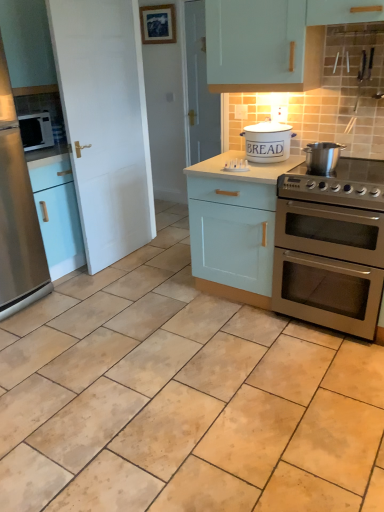
Identify the location of light blue wood cabinet at center. This screenshot has height=512, width=384. (234, 226).

Describe the element at coordinates (234, 226) in the screenshot. I see `light blue wood cabinet at center` at that location.

Describe the element at coordinates (36, 131) in the screenshot. I see `satin silver microwave at left` at that location.

The image size is (384, 512). What do you see at coordinates (329, 265) in the screenshot?
I see `satin silver oven at right` at bounding box center [329, 265].

What is the approximate width of white ceramic bread bin at center, the 2th appliance from the front?

11.77 inches.

Locate an element on the screen. This screenshot has width=384, height=512. light blue wood cabinet at center is located at coordinates (234, 226).

Is light blue wood cabinet at center looking in the opposite direction of stainless steel refrigerator at left?

No.

Locate an element on the screen. Image resolution: width=384 pixels, height=512 pixels. cabinetry below the stainless steel refrigerator at left (from the image's perspective) is located at coordinates (234, 226).

Is there a large distance between light blue wood cabinet at center and stainless steel refrigerator at left?

Yes, light blue wood cabinet at center and stainless steel refrigerator at left are quite far apart.

Which point is more forward, (204,263) or (1,269)?

The point (1,269) is more forward.

Which is more distant, (x=274, y=151) or (x=16, y=181)?

The point (x=16, y=181) is farther from the camera.

Which is behind, white ceramic bread bin at center, the 1th appliance from the back, or stainless steel refrigerator at left?

Positioned behind is white ceramic bread bin at center, the 1th appliance from the back.

Can you confirm if white ceramic bread bin at center, the 2th appliance from the front, is shorter than stainless steel refrigerator at left?

Indeed, white ceramic bread bin at center, the 2th appliance from the front, has a lesser height compared to stainless steel refrigerator at left.

Looking at this image, is white ceramic bread bin at center, the 1th appliance from the back, inside or outside of stainless steel refrigerator at left?

white ceramic bread bin at center, the 1th appliance from the back, cannot be found inside stainless steel refrigerator at left.

Is stainless steel gas stove at right smaller than stainless steel pot at upper right, the second appliance viewed from the back?

No, stainless steel gas stove at right is not smaller than stainless steel pot at upper right, the second appliance viewed from the back.

Consider the image. Is stainless steel gas stove at right at the left side of stainless steel pot at upper right, which is counted as the 1th appliance, starting from the front?

In fact, stainless steel gas stove at right is to the right of stainless steel pot at upper right, which is counted as the 1th appliance, starting from the front.

From a real-world perspective, relative to stainless steel pot at upper right, which is counted as the 1th appliance, starting from the front, is stainless steel gas stove at right vertically above or below?

From a real-world perspective, stainless steel gas stove at right is physically below stainless steel pot at upper right, which is counted as the 1th appliance, starting from the front.

Between stainless steel gas stove at right and stainless steel pot at upper right, which is counted as the 1th appliance, starting from the front, which one is positioned in front?

stainless steel gas stove at right is closer to the camera.

Is light blue wood cabinet at center not close to stainless steel pot at upper right, the second appliance viewed from the back?

Actually, light blue wood cabinet at center and stainless steel pot at upper right, the second appliance viewed from the back, are a little close together.

How far apart are light blue wood cabinet at center and stainless steel pot at upper right, the second appliance viewed from the back?

They are 22.28 inches apart.

Which is further, (237, 216) or (330, 172)?

The point (237, 216) is farther.

Looking at this image, visually, is light blue wood cabinet at center positioned to the left or to the right of stainless steel pot at upper right, which is counted as the 1th appliance, starting from the front?

In the image, light blue wood cabinet at center appears on the left side of stainless steel pot at upper right, which is counted as the 1th appliance, starting from the front.

In the image, is satin silver oven at right positioned in front of or behind light blue wood cabinet at center?

satin silver oven at right is in front of light blue wood cabinet at center.

Consider the image. Considering the sizes of objects satin silver oven at right and light blue wood cabinet at center in the image provided, who is smaller, satin silver oven at right or light blue wood cabinet at center?

satin silver oven at right is smaller.

From a real-world perspective, is satin silver oven at right positioned above or below light blue wood cabinet at center?

Clearly, from a real-world perspective, satin silver oven at right is below light blue wood cabinet at center.

Considering the relative sizes of satin silver oven at right and light blue wood cabinet at center in the image provided, is satin silver oven at right wider than light blue wood cabinet at center?

Yes, satin silver oven at right is wider than light blue wood cabinet at center.

Who is smaller, stainless steel gas stove at right or light blue wood cabinet at center?

Smaller between the two is stainless steel gas stove at right.

From a real-world perspective, between stainless steel gas stove at right and light blue wood cabinet at center, who is vertically lower?

From a 3D spatial view, light blue wood cabinet at center is below.

The height and width of the screenshot is (512, 384). In order to click on cabinetry located underneath the stainless steel gas stove at right (from a real-world perspective) in this screenshot , I will do `click(234, 226)`.

Which object is wider, stainless steel gas stove at right or light blue wood cabinet at center?

Wider between the two is light blue wood cabinet at center.

Is stainless steel pot at upper right, which is counted as the 1th appliance, starting from the front, thinner than light blue wood cabinet at center?

Yes.

Is stainless steel pot at upper right, the second appliance viewed from the back, facing away from light blue wood cabinet at center?

No.

Locate an element on the screen. The width and height of the screenshot is (384, 512). fridge located above the light blue wood cabinet at center (from the image's perspective) is located at coordinates (17, 214).

Where is `fridge that is below the white ceramic bread bin at center, the 1th appliance from the back (from the image's perspective)`? This screenshot has height=512, width=384. fridge that is below the white ceramic bread bin at center, the 1th appliance from the back (from the image's perspective) is located at coordinates (17, 214).

Estimate the real-world distances between objects in this image. Which object is closer to stainless steel gas stove at right, light blue wood cabinet at center or satin silver oven at right?

satin silver oven at right is closer to stainless steel gas stove at right.

When comparing their distances from stainless steel gas stove at right, does satin silver microwave at left or white ceramic bread bin at center, the 1th appliance from the back, seem closer?

The object closer to stainless steel gas stove at right is white ceramic bread bin at center, the 1th appliance from the back.

Estimate the real-world distances between objects in this image. Which object is closer to stainless steel gas stove at right, satin silver microwave at left or satin silver oven at right?

Based on the image, satin silver oven at right appears to be nearer to stainless steel gas stove at right.

Considering their positions, is white ceramic bread bin at center, the 2th appliance from the front, positioned closer to stainless steel refrigerator at left than stainless steel gas stove at right?

white ceramic bread bin at center, the 2th appliance from the front, is positioned closer to the anchor stainless steel refrigerator at left.

From the image, which object appears to be farther from white ceramic bread bin at center, the 2th appliance from the front, satin silver oven at right or stainless steel refrigerator at left?

Based on the image, stainless steel refrigerator at left appears to be further to white ceramic bread bin at center, the 2th appliance from the front.

Based on their spatial positions, is white ceramic bread bin at center, the 1th appliance from the back, or stainless steel refrigerator at left closer to satin silver microwave at left?

Among the two, stainless steel refrigerator at left is located nearer to satin silver microwave at left.

Which object lies further to the anchor point satin silver microwave at left, white ceramic bread bin at center, the 1th appliance from the back, or satin silver oven at right?

satin silver oven at right is further to satin silver microwave at left.

When comparing their distances from stainless steel gas stove at right, does stainless steel refrigerator at left or white ceramic bread bin at center, the 1th appliance from the back, seem closer?

white ceramic bread bin at center, the 1th appliance from the back, is positioned closer to the anchor stainless steel gas stove at right.

Identify the location of appliance between satin silver microwave at left and stainless steel pot at upper right, the second appliance viewed from the back, from left to right. (268, 142).

The image size is (384, 512). I want to click on gas stove between stainless steel pot at upper right, the second appliance viewed from the back, and satin silver oven at right, in the vertical direction, so click(337, 184).

This screenshot has height=512, width=384. I want to click on gas stove that lies between white ceramic bread bin at center, the 2th appliance from the front, and light blue wood cabinet at center from top to bottom, so click(x=337, y=184).

Where is `cabinetry between stainless steel refrigerator at left and stainless steel pot at upper right, the second appliance viewed from the back, from left to right`? Image resolution: width=384 pixels, height=512 pixels. cabinetry between stainless steel refrigerator at left and stainless steel pot at upper right, the second appliance viewed from the back, from left to right is located at coordinates (234, 226).